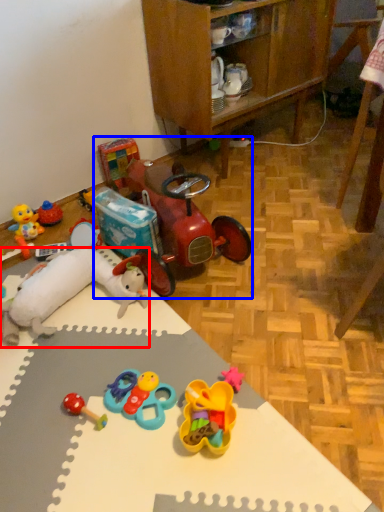
Question: Which object appears farthest to the camera in this image, toy (highlighted by a red box) or toy car (highlighted by a blue box)?

Choices:
 (A) toy
 (B) toy car

Answer: (B)